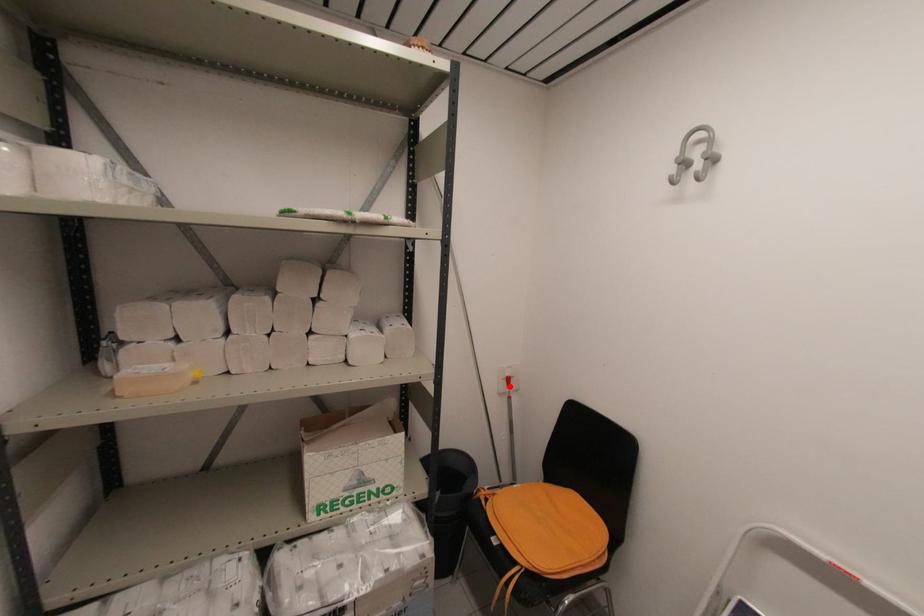
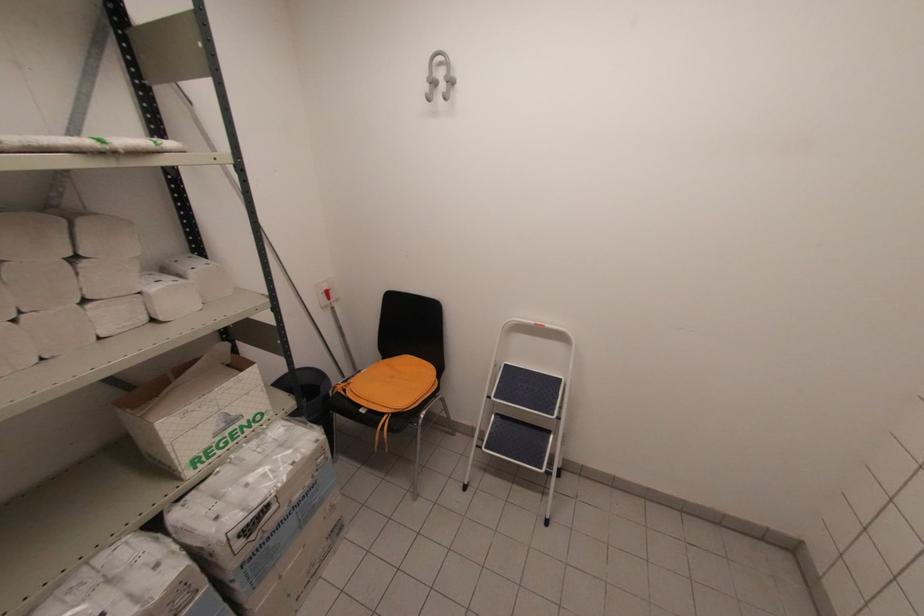
Find the pixel in the second image that matches the highlighted location in the first image.

(330, 299)